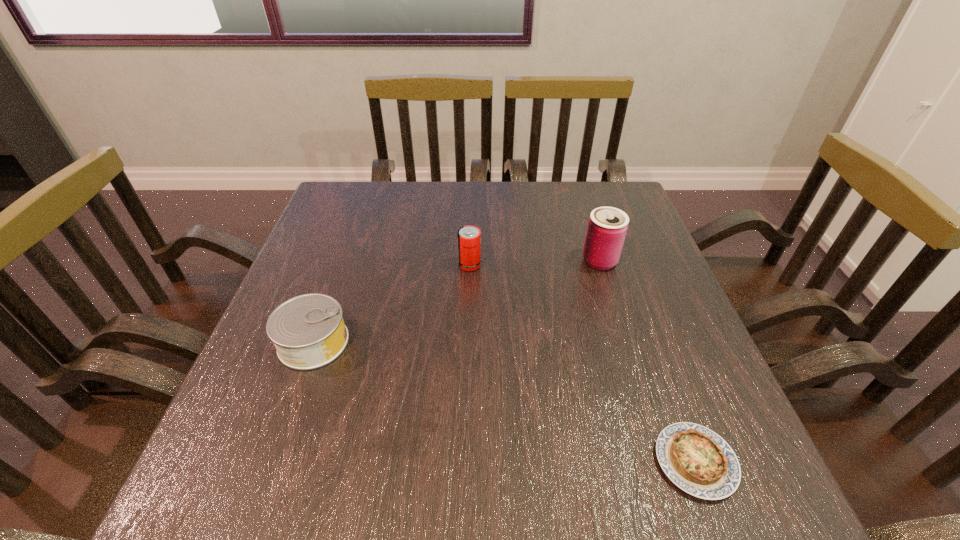
Where is `blank area in the image that satisfies the following two spatial constraints: 1. on the back side of the shortest can; 2. on the left side of the tallest can`? blank area in the image that satisfies the following two spatial constraints: 1. on the back side of the shortest can; 2. on the left side of the tallest can is located at coordinates (343, 261).

Identify the location of vacant point that satisfies the following two spatial constraints: 1. on the back side of the leftmost object; 2. on the left side of the second tallest can. This screenshot has width=960, height=540. (342, 265).